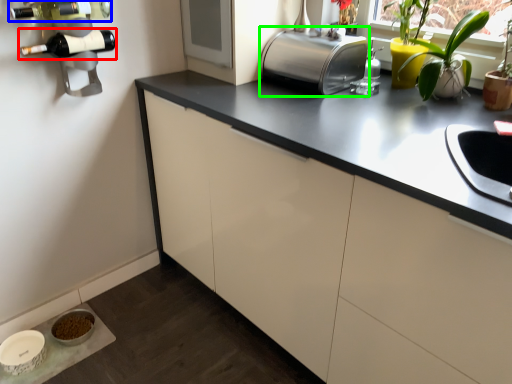
Question: Which object is the farthest from wine bottle (highlighted by a red box)? Choose among these: wine bottle (highlighted by a blue box) or toaster (highlighted by a green box).

Choices:
 (A) wine bottle
 (B) toaster

Answer: (B)